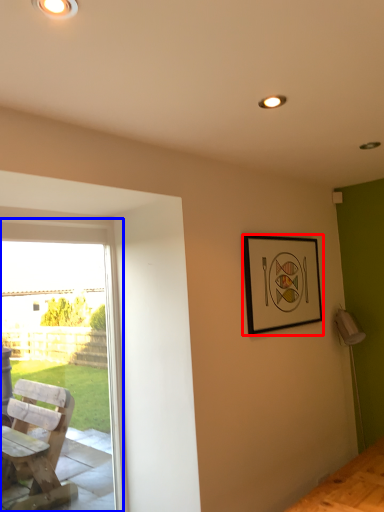
Question: Which object is further to the camera taking this photo, picture frame (highlighted by a red box) or window (highlighted by a blue box)?

Choices:
 (A) picture frame
 (B) window

Answer: (A)